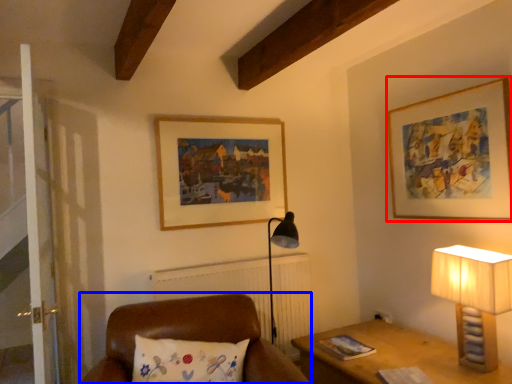
Question: Among these objects, which one is farthest to the camera, picture frame (highlighted by a red box) or furniture (highlighted by a blue box)?

Choices:
 (A) picture frame
 (B) furniture

Answer: (A)